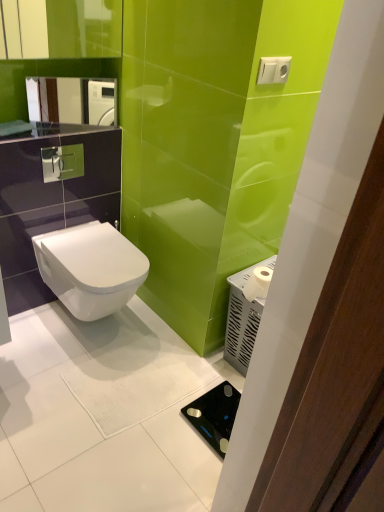
What is the approximate width of black glass scale at lower right?

The width of black glass scale at lower right is 11.56 inches.

Locate an element on the screen. white matte toilet paper at right is located at coordinates (258, 283).

In order to face white glossy toilet at center, should I rotate leftwards or rightwards?

You should look left and rotate roughly 12.661 degrees.

Where is `black glass scale at lower right`? Image resolution: width=384 pixels, height=512 pixels. black glass scale at lower right is located at coordinates (214, 415).

Is white glossy toilet at center outside of black glass scale at lower right?

Indeed, white glossy toilet at center is completely outside black glass scale at lower right.

Is the surface of white glossy toilet at center in direct contact with black glass scale at lower right?

No, white glossy toilet at center is not next to black glass scale at lower right.

Is white glossy toilet at center taller than black glass scale at lower right?

Correct, white glossy toilet at center is much taller as black glass scale at lower right.

Is black glass scale at lower right further to camera compared to white glossy toilet at center?

No, it is not.

Which object is positioned more to the left, black glass scale at lower right or white glossy toilet at center?

white glossy toilet at center.

How distant is black glass scale at lower right from white glossy toilet at center?

A distance of 28.38 inches exists between black glass scale at lower right and white glossy toilet at center.

Is black glass scale at lower right smaller than white glossy toilet at center?

Correct, black glass scale at lower right occupies less space than white glossy toilet at center.

Is white matte toilet paper at right outside of black glass scale at lower right?

Yes, white matte toilet paper at right is located beyond the bounds of black glass scale at lower right.

Which object is closer to the camera, white matte toilet paper at right or black glass scale at lower right?

black glass scale at lower right is closer to the camera.

From a real-world perspective, which object stands above the other?

white matte toilet paper at right, from a real-world perspective.

Measure the distance from white matte toilet paper at right to black glass scale at lower right.

The distance of white matte toilet paper at right from black glass scale at lower right is 19.46 inches.

In the scene shown: Is white matte toilet paper at right positioned far away from white glossy toilet at center?

No, white matte toilet paper at right is not far from white glossy toilet at center.

Consider the image. Does white matte toilet paper at right have a smaller size compared to white glossy toilet at center?

Correct, white matte toilet paper at right occupies less space than white glossy toilet at center.

Considering the relative sizes of white matte toilet paper at right and white glossy toilet at center in the image provided, is white matte toilet paper at right shorter than white glossy toilet at center?

Yes.

Does white matte toilet paper at right have a lesser width compared to white glossy toilet at center?

Yes.

Between white glossy toilet at center and white matte toilet paper at right, which one has larger width?

With larger width is white glossy toilet at center.

Is white glossy toilet at center behind white matte toilet paper at right?

Yes, the depth of white glossy toilet at center is greater than that of white matte toilet paper at right.

In terms of height, does white glossy toilet at center look taller or shorter compared to white matte toilet paper at right?

white glossy toilet at center is taller than white matte toilet paper at right.

Is white glossy toilet at center completely or partially outside of white matte toilet paper at right?

Yes, white glossy toilet at center is not within white matte toilet paper at right.

Is black glass scale at lower right at the right side of white matte toilet paper at right?

In fact, black glass scale at lower right is to the left of white matte toilet paper at right.

Is black glass scale at lower right positioned with its back to white matte toilet paper at right?

black glass scale at lower right is not turned away from white matte toilet paper at right.

Is black glass scale at lower right far away from white matte toilet paper at right?

black glass scale at lower right is near white matte toilet paper at right, not far away.

Which of these two, black glass scale at lower right or white matte toilet paper at right, is thinner?

With smaller width is white matte toilet paper at right.

Locate an element on the screen. appliance below the white glossy toilet at center (from a real-world perspective) is located at coordinates (214, 415).

The image size is (384, 512). I want to click on toilet to the left of black glass scale at lower right, so click(x=90, y=268).

When comparing their distances from white glossy toilet at center, does white matte toilet paper at right or black glass scale at lower right seem closer?

white matte toilet paper at right is closer to white glossy toilet at center.

Considering their positions, is black glass scale at lower right positioned closer to white matte toilet paper at right than white glossy toilet at center?

Based on the image, black glass scale at lower right appears to be nearer to white matte toilet paper at right.

Looking at the image, which one is located further to black glass scale at lower right, white matte toilet paper at right or white glossy toilet at center?

Among the two, white glossy toilet at center is located further to black glass scale at lower right.

Estimate the real-world distances between objects in this image. Which object is further from white matte toilet paper at right, white glossy toilet at center or black glass scale at lower right?

white glossy toilet at center is further to white matte toilet paper at right.

Which object lies further to the anchor point black glass scale at lower right, white glossy toilet at center or white matte toilet paper at right?

white glossy toilet at center.

Looking at the image, which one is located further to white glossy toilet at center, black glass scale at lower right or white matte toilet paper at right?

Among the two, black glass scale at lower right is located further to white glossy toilet at center.

What are the coordinates of `appliance located between white glossy toilet at center and white matte toilet paper at right in the left-right direction` in the screenshot? It's located at (214, 415).